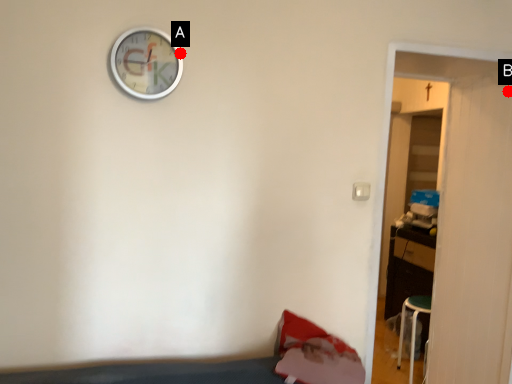
Question: Two points are circled on the image, labeled by A and B beside each circle. Which point is closer to the camera?

Choices:
 (A) A is closer
 (B) B is closer

Answer: (A)